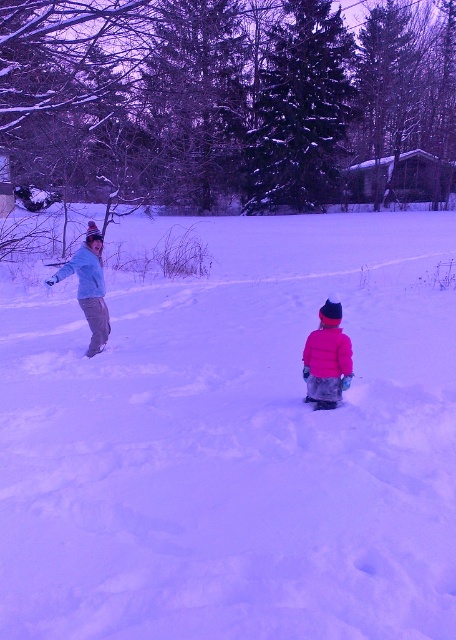
You are a photographer trying to capture a photo of both the pink fleece jacket at center and the matte blue jacket at left in the same frame. Based on their positions, which jacket should you focus on first to ensure both are in focus?

The pink fleece jacket at center is much taller than the matte blue jacket at left, so focusing on the pink fleece jacket at center first will help ensure both are in focus since it is the taller subject.

You are a photographer trying to capture the scene with the white fluffy snow at center and the pink fleece jacket at center. If you want to frame the snow to the left of the jacket, is the current arrangement suitable?

Yes, the current arrangement is suitable because the white fluffy snow at center is already positioned to the left of the pink fleece jacket at center, aligning with your framing preference.